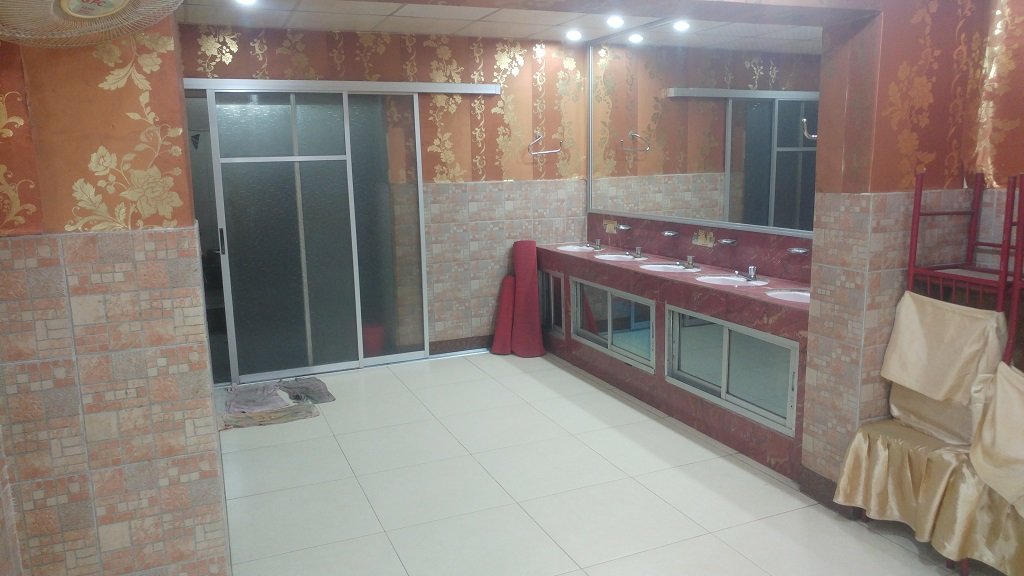
Locate an element on the screen. The image size is (1024, 576). mirror is located at coordinates (717, 149).